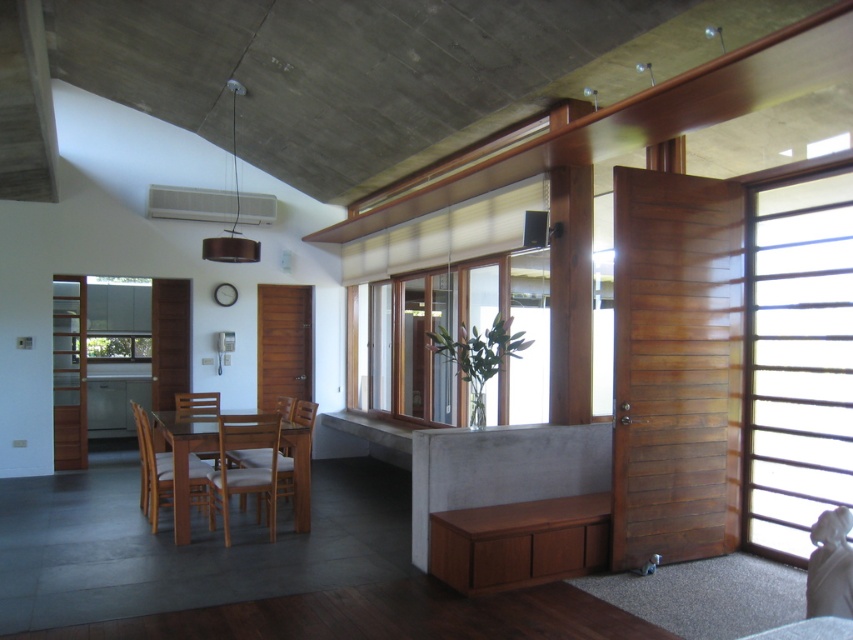
You are standing in the modern interior space described. You see two points marked in the image. Which point, point (814, 365) or point (260, 456), is closer to you?

Point (814, 365) is closer to the camera than point (260, 456).

You are planning to hang a large painting that is 1.8 meters tall on the wall next to the wooden slats at right and the light brown wooden chair at center. Based on their heights, which object would you consider when deciding where to place the painting?

The wooden slats at right is taller than the light brown wooden chair at center, so you should consider the height of the wooden slats at right to ensure the painting is appropriately placed without being obstructed.